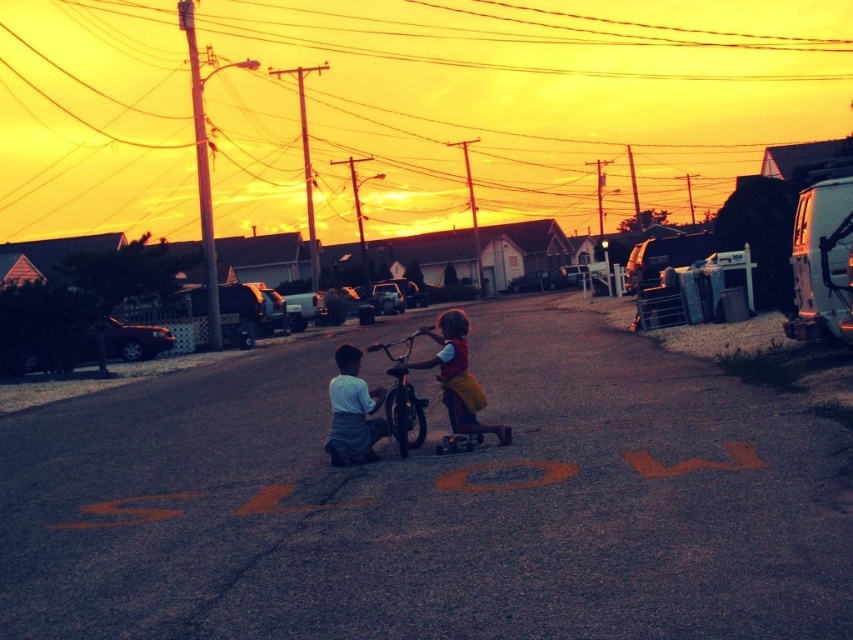
Looking at this image, can you confirm if matte white shirt at center is shorter than metallic silver bicycle at center?

Incorrect, matte white shirt at center's height does not fall short of metallic silver bicycle at center's.

Does point (350, 385) lie in front of point (410, 401)?

That is True.

This screenshot has width=853, height=640. Identify the location of matte white shirt at center. (352, 412).

Is matte yellow shorts at center taller than metallic silver bicycle at center?

Yes.

Looking at this image, which is above, matte yellow shorts at center or metallic silver bicycle at center?

metallic silver bicycle at center

Find the location of `matte yellow shorts at center`. matte yellow shorts at center is located at coordinates (457, 378).

Which of these two, matte yellow shorts at center or matte white shirt at center, stands taller?

matte yellow shorts at center is taller.

At what (x,y) coordinates should I click in order to perform the action: click on matte yellow shorts at center. Please return your answer as a coordinate pair (x, y). This screenshot has height=640, width=853. Looking at the image, I should click on (457, 378).